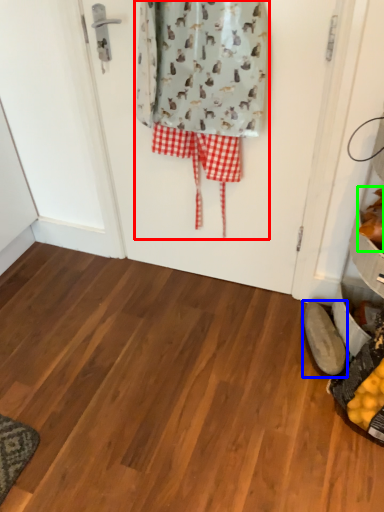
Question: Which is nearer to the laundry (highlighted by a red box)? footwear (highlighted by a blue box) or food (highlighted by a green box).

Choices:
 (A) footwear
 (B) food

Answer: (B)